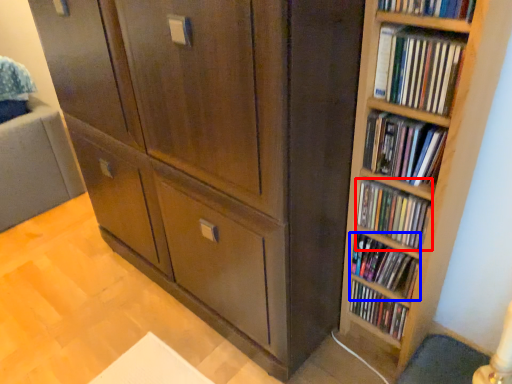
Question: Which object is further to the camera taking this photo, book (highlighted by a red box) or book (highlighted by a blue box)?

Choices:
 (A) book
 (B) book

Answer: (B)